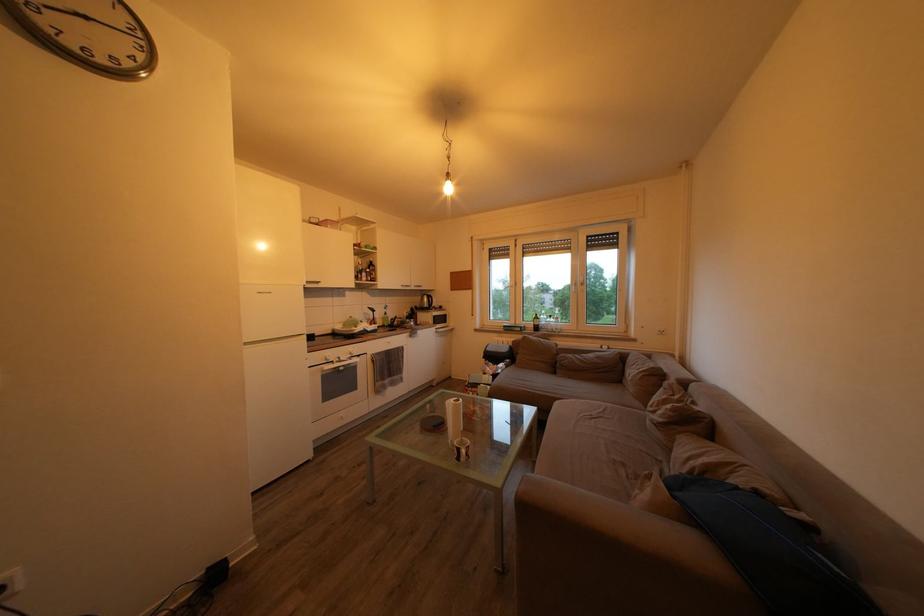
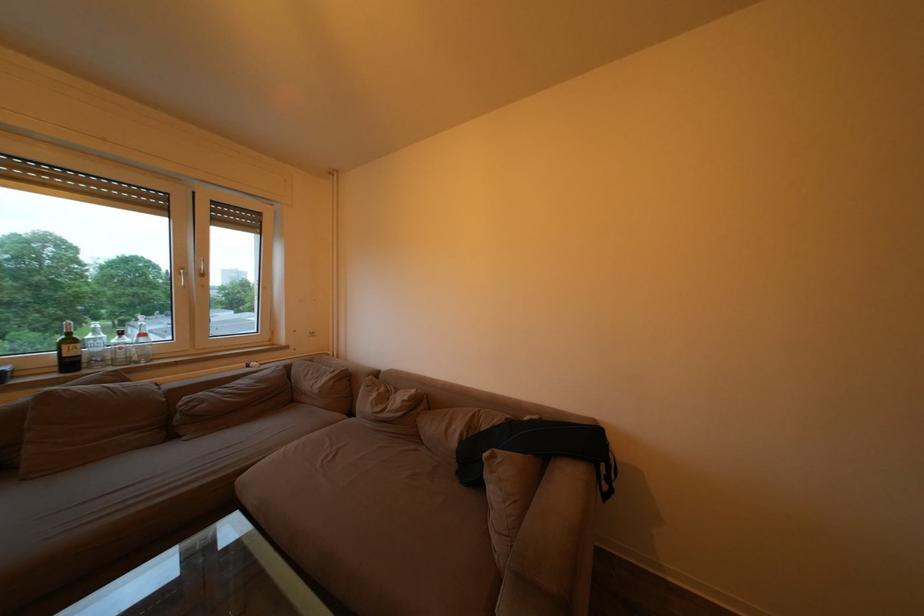
The point at (558, 323) is marked in the first image. Where is the corresponding point in the second image?

(129, 339)